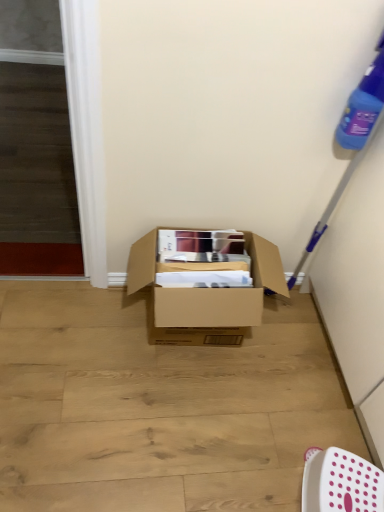
Where is `free space between brown cardboard box at center and white plastic chair at lower right`? The width and height of the screenshot is (384, 512). free space between brown cardboard box at center and white plastic chair at lower right is located at coordinates (258, 403).